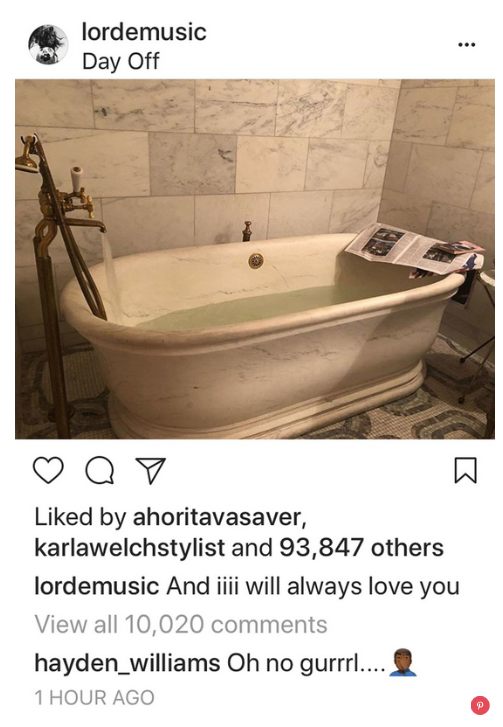
You are a GUI agent. You are given a task and a screenshot of the screen. Output one action in this format:
    pyautogui.click(x=<x>, y=<y>)
    Task: Click on the tub faucet
    
    Given the screenshot: What is the action you would take?
    pyautogui.click(x=97, y=222)